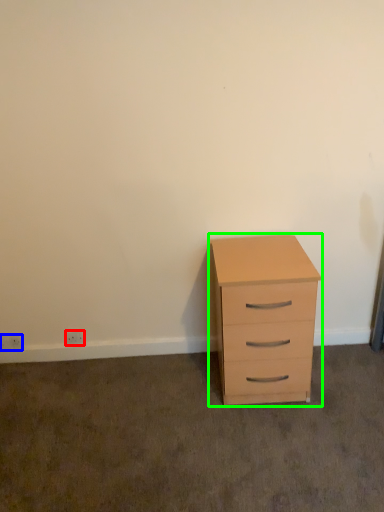
Question: Estimate the real-world distances between objects in this image. Which object is closer to electric outlet (highlighted by a red box), electric outlet (highlighted by a blue box) or chest of drawers (highlighted by a green box)?

Choices:
 (A) electric outlet
 (B) chest of drawers

Answer: (A)